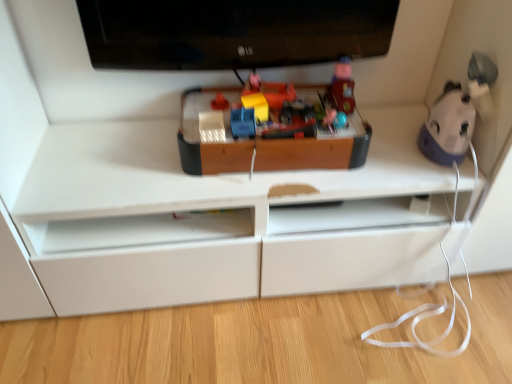
At what (x,y) coordinates should I click in order to perform the action: click on yellow plastic toy at center, the third toy positioned from the left. Please return your answer as a coordinate pair (x, y). The height and width of the screenshot is (384, 512). Looking at the image, I should click on (255, 98).

Identify the location of wooden toy at center, the 3th toy positioned from the right. (275, 127).

Locate an element on the screen. blue plastic toy at right, the 6th toy when ordered from left to right is located at coordinates (448, 126).

Which of these two, black glossy television at upper center or matte plastic toy at center, which appears as the first toy when viewed from the left, stands shorter?

Standing shorter between the two is matte plastic toy at center, which appears as the first toy when viewed from the left.

Does black glossy television at upper center lie behind matte plastic toy at center, which ranks as the sixth toy in right-to-left order?

No, the depth of black glossy television at upper center is less than that of matte plastic toy at center, which ranks as the sixth toy in right-to-left order.

At what (x,y) coordinates should I click in order to perform the action: click on the 2nd toy below the black glossy television at upper center (from the image's perspective). Please return your answer as a coordinate pair (x, y). The height and width of the screenshot is (384, 512). Looking at the image, I should click on (219, 102).

Looking at their sizes, would you say black glossy television at upper center is wider or thinner than matte plastic toy at center, which ranks as the sixth toy in right-to-left order?

black glossy television at upper center is wider than matte plastic toy at center, which ranks as the sixth toy in right-to-left order.

Which point is more forward, (x=462, y=112) or (x=252, y=120)?

Point (x=252, y=120)

Which object is wider, blue plastic toy at right, placed as the first toy when sorted from right to left, or matte blue plastic toy car at center, the fifth toy from the right?

With larger width is blue plastic toy at right, placed as the first toy when sorted from right to left.

Is blue plastic toy at right, the 6th toy when ordered from left to right, spatially inside matte blue plastic toy car at center, arranged as the 2th toy when viewed from the left, or outside of it?

blue plastic toy at right, the 6th toy when ordered from left to right, lies outside matte blue plastic toy car at center, arranged as the 2th toy when viewed from the left.

Between blue plastic toy at right, placed as the first toy when sorted from right to left, and matte blue plastic toy car at center, the fifth toy from the right, which one has more height?

Standing taller between the two is blue plastic toy at right, placed as the first toy when sorted from right to left.

Is matte blue plastic toy car at center, arranged as the 2th toy when viewed from the left, wider than blue plastic toy at right, placed as the first toy when sorted from right to left?

No, matte blue plastic toy car at center, arranged as the 2th toy when viewed from the left, is not wider than blue plastic toy at right, placed as the first toy when sorted from right to left.

Is matte blue plastic toy car at center, arranged as the 2th toy when viewed from the left, at the right side of blue plastic toy at right, the 6th toy when ordered from left to right?

No.

Is matte blue plastic toy car at center, arranged as the 2th toy when viewed from the left, facing away from blue plastic toy at right, placed as the first toy when sorted from right to left?

That's not correct — matte blue plastic toy car at center, arranged as the 2th toy when viewed from the left, is not looking away from blue plastic toy at right, placed as the first toy when sorted from right to left.

Is matte blue plastic toy car at center, the fifth toy from the right, bigger than blue plastic toy at right, placed as the first toy when sorted from right to left?

No.

Is matte plastic toy at upper center, the 5th toy viewed from the left, smaller than wooden toy at center, the 3th toy positioned from the right?

Yes, matte plastic toy at upper center, the 5th toy viewed from the left, is smaller than wooden toy at center, the 3th toy positioned from the right.

Can you confirm if matte plastic toy at upper center, the 5th toy viewed from the left, is thinner than wooden toy at center, placed as the fourth toy when sorted from left to right?

Indeed, matte plastic toy at upper center, the 5th toy viewed from the left, has a lesser width compared to wooden toy at center, placed as the fourth toy when sorted from left to right.

Does point (341, 73) come closer to viewer compared to point (275, 160)?

No.

Is black glossy television at upper center located within matte blue plastic toy car at center, arranged as the 2th toy when viewed from the left?

No, matte blue plastic toy car at center, arranged as the 2th toy when viewed from the left, does not contain black glossy television at upper center.

Can you confirm if matte blue plastic toy car at center, the fifth toy from the right, is positioned to the left of black glossy television at upper center?

Correct, you'll find matte blue plastic toy car at center, the fifth toy from the right, to the left of black glossy television at upper center.

From a real-world perspective, who is located higher, yellow plastic toy at center, the fourth toy from the right, or matte plastic toy at center, which appears as the first toy when viewed from the left?

From a 3D spatial view, yellow plastic toy at center, the fourth toy from the right, is above.

Is yellow plastic toy at center, the third toy positioned from the left, looking in the opposite direction of matte plastic toy at center, which ranks as the sixth toy in right-to-left order?

No, yellow plastic toy at center, the third toy positioned from the left,'s orientation is not away from matte plastic toy at center, which ranks as the sixth toy in right-to-left order.

Considering the relative sizes of yellow plastic toy at center, the fourth toy from the right, and matte plastic toy at center, which appears as the first toy when viewed from the left, in the image provided, is yellow plastic toy at center, the fourth toy from the right, wider than matte plastic toy at center, which appears as the first toy when viewed from the left,?

Yes.

Between yellow plastic toy at center, the fourth toy from the right, and matte plastic toy at center, which appears as the first toy when viewed from the left, which one has smaller size?

With smaller size is matte plastic toy at center, which appears as the first toy when viewed from the left.

From the picture: From a real-world perspective, is wooden toy at center, placed as the fourth toy when sorted from left to right, above or below black glossy television at upper center?

wooden toy at center, placed as the fourth toy when sorted from left to right, is situated lower than black glossy television at upper center in the real world.

Considering the sizes of objects wooden toy at center, placed as the fourth toy when sorted from left to right, and black glossy television at upper center in the image provided, who is shorter, wooden toy at center, placed as the fourth toy when sorted from left to right, or black glossy television at upper center?

wooden toy at center, placed as the fourth toy when sorted from left to right, is shorter.

Between wooden toy at center, placed as the fourth toy when sorted from left to right, and black glossy television at upper center, which one has smaller size?

wooden toy at center, placed as the fourth toy when sorted from left to right, is smaller.

Locate an element on the screen. television located above the matte plastic toy at center, which appears as the first toy when viewed from the left (from the image's perspective) is located at coordinates (233, 32).

From the image's perspective, count 2nd toys downward from the blue plastic toy at right, the 6th toy when ordered from left to right, and point to it. Please provide its 2D coordinates.

[(243, 123)]

Looking at the image, which one is located further to yellow plastic toy at center, the third toy positioned from the left, matte plastic toy at upper center, which appears as the 2th toy when viewed from the right, or black glossy television at upper center?

Answer: Among the two, black glossy television at upper center is located further to yellow plastic toy at center, the third toy positioned from the left.

Which object lies further to the anchor point blue plastic toy at right, the 6th toy when ordered from left to right, matte blue plastic toy car at center, the fifth toy from the right, or matte plastic toy at center, which appears as the first toy when viewed from the left?

Based on the image, matte plastic toy at center, which appears as the first toy when viewed from the left, appears to be further to blue plastic toy at right, the 6th toy when ordered from left to right.

Estimate the real-world distances between objects in this image. Which object is further from matte plastic toy at center, which ranks as the sixth toy in right-to-left order, blue plastic toy at right, the 6th toy when ordered from left to right, or matte plastic toy at upper center, which appears as the 2th toy when viewed from the right?

blue plastic toy at right, the 6th toy when ordered from left to right, is positioned further to the anchor matte plastic toy at center, which ranks as the sixth toy in right-to-left order.

Estimate the real-world distances between objects in this image. Which object is further from matte blue plastic toy car at center, arranged as the 2th toy when viewed from the left, wooden toy at center, placed as the fourth toy when sorted from left to right, or blue plastic toy at right, the 6th toy when ordered from left to right?

The object further to matte blue plastic toy car at center, arranged as the 2th toy when viewed from the left, is blue plastic toy at right, the 6th toy when ordered from left to right.

Looking at this image, from the image, which object appears to be nearer to matte plastic toy at center, which appears as the first toy when viewed from the left, blue plastic toy at right, placed as the first toy when sorted from right to left, or yellow plastic toy at center, the fourth toy from the right?

yellow plastic toy at center, the fourth toy from the right, is closer to matte plastic toy at center, which appears as the first toy when viewed from the left.

Considering their positions, is blue plastic toy at right, the 6th toy when ordered from left to right, positioned further to matte blue plastic toy car at center, the fifth toy from the right, than wooden toy at center, placed as the fourth toy when sorted from left to right?

blue plastic toy at right, the 6th toy when ordered from left to right, is further to matte blue plastic toy car at center, the fifth toy from the right.

Which object lies further to the anchor point yellow plastic toy at center, the third toy positioned from the left, blue plastic toy at right, the 6th toy when ordered from left to right, or matte plastic toy at upper center, which appears as the 2th toy when viewed from the right?

blue plastic toy at right, the 6th toy when ordered from left to right, is further to yellow plastic toy at center, the third toy positioned from the left.

Looking at the image, which one is located further to black glossy television at upper center, matte blue plastic toy car at center, the fifth toy from the right, or blue plastic toy at right, placed as the first toy when sorted from right to left?

blue plastic toy at right, placed as the first toy when sorted from right to left, is further to black glossy television at upper center.

The width and height of the screenshot is (512, 384). In order to click on toy between matte blue plastic toy car at center, arranged as the 2th toy when viewed from the left, and wooden toy at center, placed as the fourth toy when sorted from left to right in this screenshot , I will do `click(255, 98)`.

Identify the location of television between matte blue plastic toy car at center, the fifth toy from the right, and matte plastic toy at upper center, which appears as the 2th toy when viewed from the right, from left to right. (233, 32).

Identify the location of television between matte plastic toy at center, which ranks as the sixth toy in right-to-left order, and blue plastic toy at right, the 6th toy when ordered from left to right, in the horizontal direction. (233, 32).

Where is `television located between matte blue plastic toy car at center, arranged as the 2th toy when viewed from the left, and blue plastic toy at right, the 6th toy when ordered from left to right, in the left-right direction`? The image size is (512, 384). television located between matte blue plastic toy car at center, arranged as the 2th toy when viewed from the left, and blue plastic toy at right, the 6th toy when ordered from left to right, in the left-right direction is located at coordinates (233, 32).